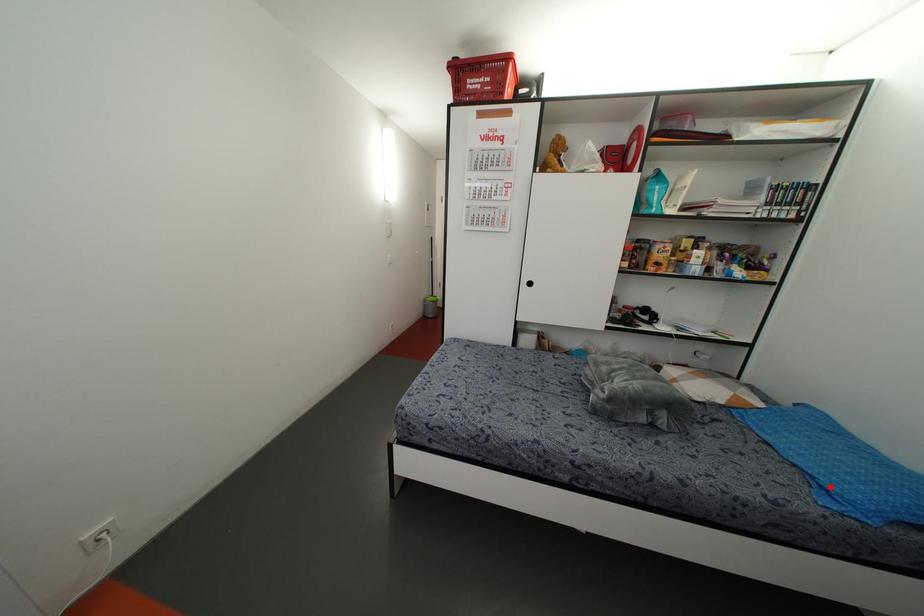
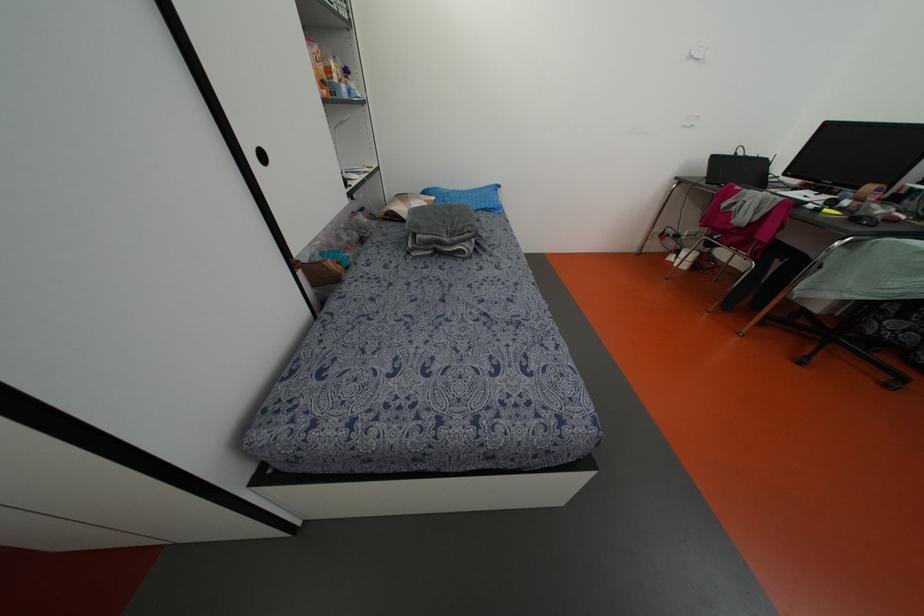
Question: I am providing you with two images of the same scene from different viewpoints. A red point is shown in image1. For the corresponding object point in image2, is it positioned nearer or farther from the camera?

Choices:
 (A) Nearer
 (B) Farther

Answer: (B)